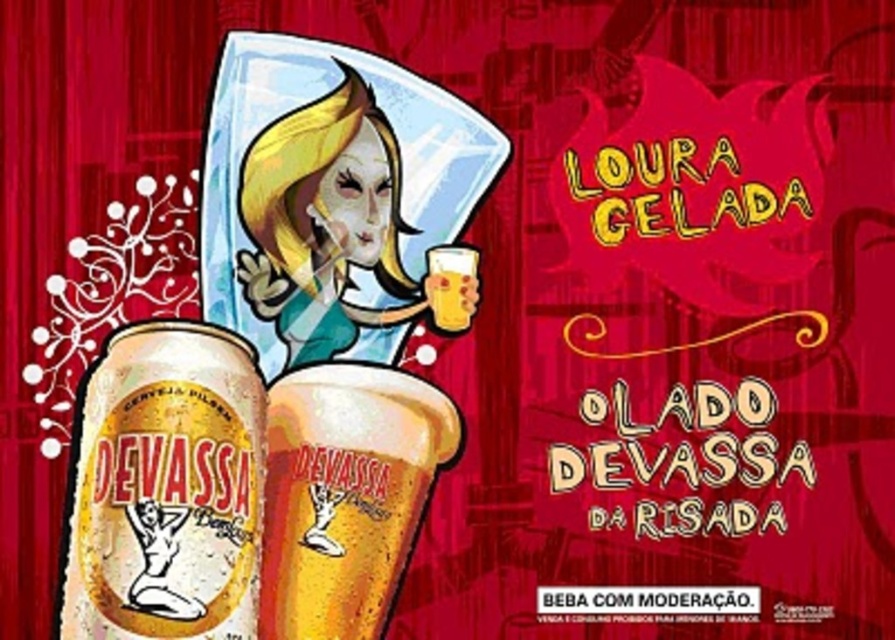
Question: Is gold metallic can at lower left wider than translucent plastic cup at center?

Choices:
 (A) yes
 (B) no

Answer: (B)

Question: Which object is the closest to the translucent plastic cup at center?

Choices:
 (A) gold metallic can at lower left
 (B) matte white face at center

Answer: (A)

Question: Is gold metallic can at lower left to the left of matte white face at center from the viewer's perspective?

Choices:
 (A) yes
 (B) no

Answer: (A)

Question: Among these objects, which one is nearest to the camera?

Choices:
 (A) translucent glass beer at center
 (B) translucent plastic cup at center
 (C) gold metallic can at lower left
 (D) matte white face at center

Answer: (C)

Question: Does matte white face at center have a larger size compared to translucent glass beer at center?

Choices:
 (A) no
 (B) yes

Answer: (B)

Question: Among these points, which one is farthest from the camera?

Choices:
 (A) (429, 292)
 (B) (296, 442)
 (C) (167, 618)

Answer: (A)